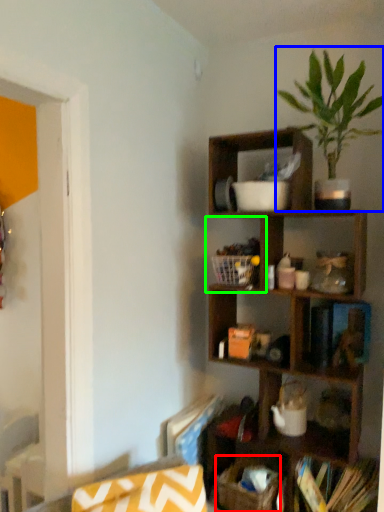
Question: Considering the real-world distances, which object is closest to basket (highlighted by a red box)? houseplant (highlighted by a blue box) or cabinet (highlighted by a green box).

Choices:
 (A) houseplant
 (B) cabinet

Answer: (B)